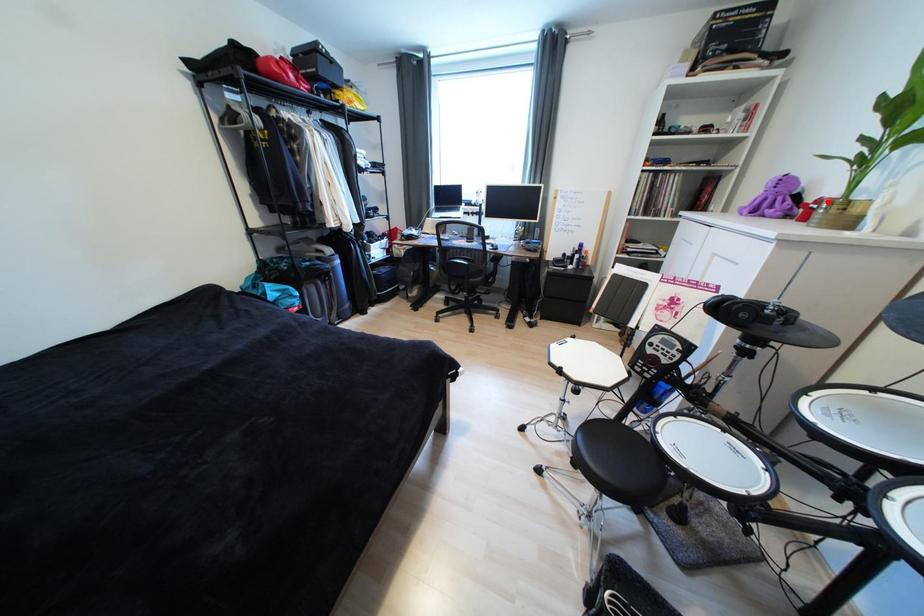
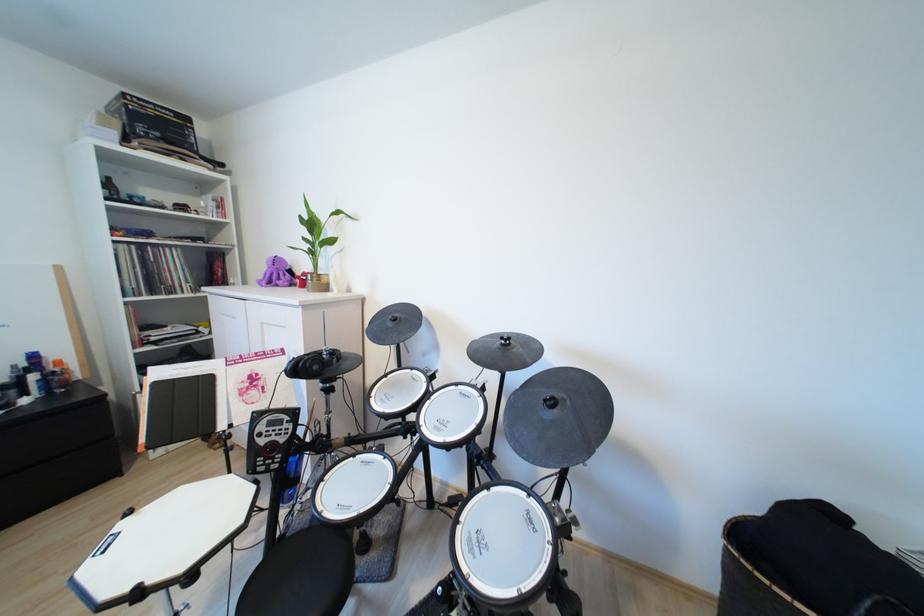
Where in the second image is the point corresponding to the highlighted location from the first image?

(310, 275)